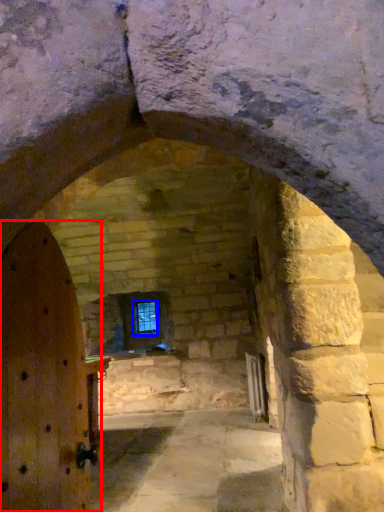
Question: Which of the following is the farthest to the observer, door (highlighted by a red box) or window (highlighted by a blue box)?

Choices:
 (A) door
 (B) window

Answer: (B)